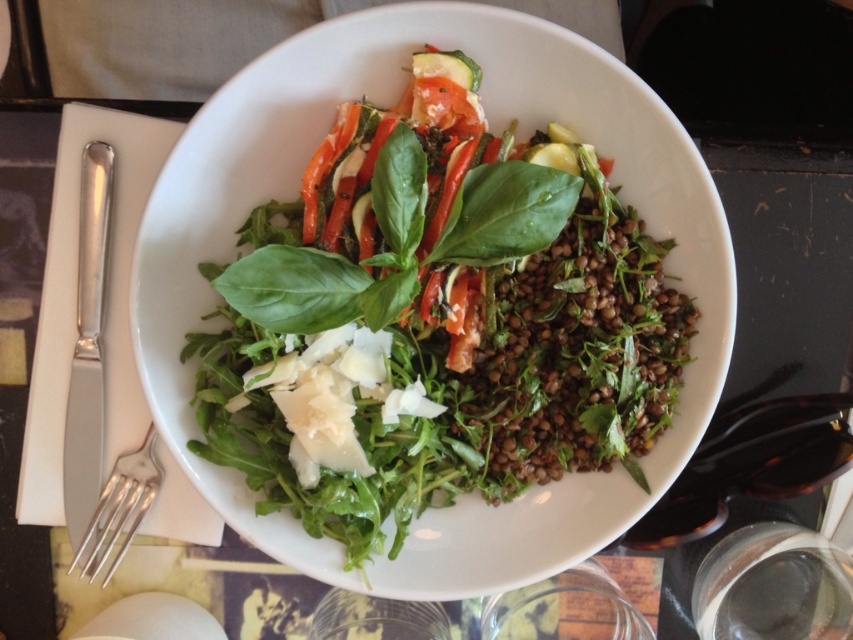
You are sitting at the dark wooden table and want to place a napkin between the two points, point (102,448) and point (141,509). Which point should you place the napkin closer to so it is in front of the other point?

You should place the napkin closer to point (102,448) because it is in front of point (141,509).

You are a food stylist arranging a photo shoot. You have a green leafy salad at center and a satin finish knife at left. Which item is more to the right?

The green leafy salad at center is more to the right than the satin finish knife at left.